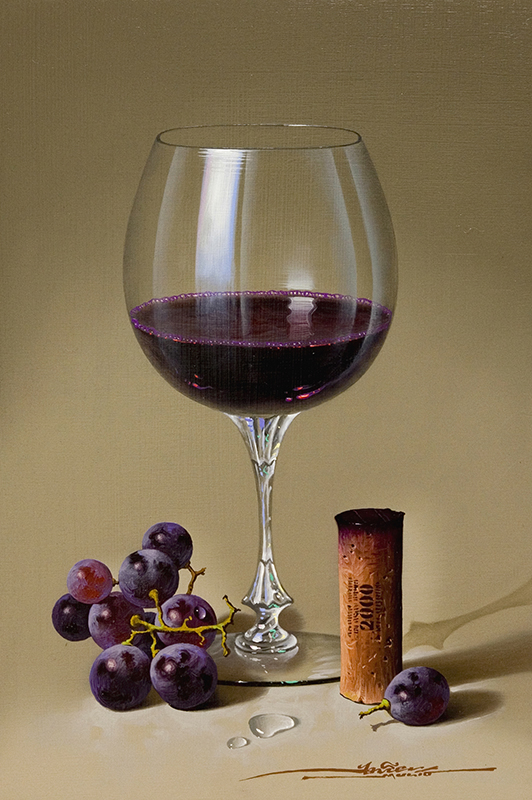
The width and height of the screenshot is (532, 800). I want to click on cork, so click(381, 584).